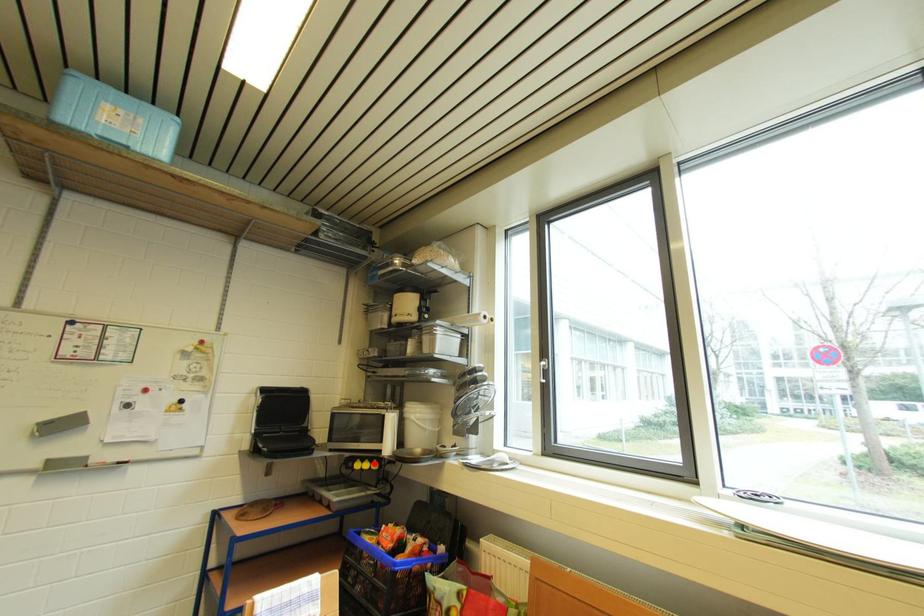
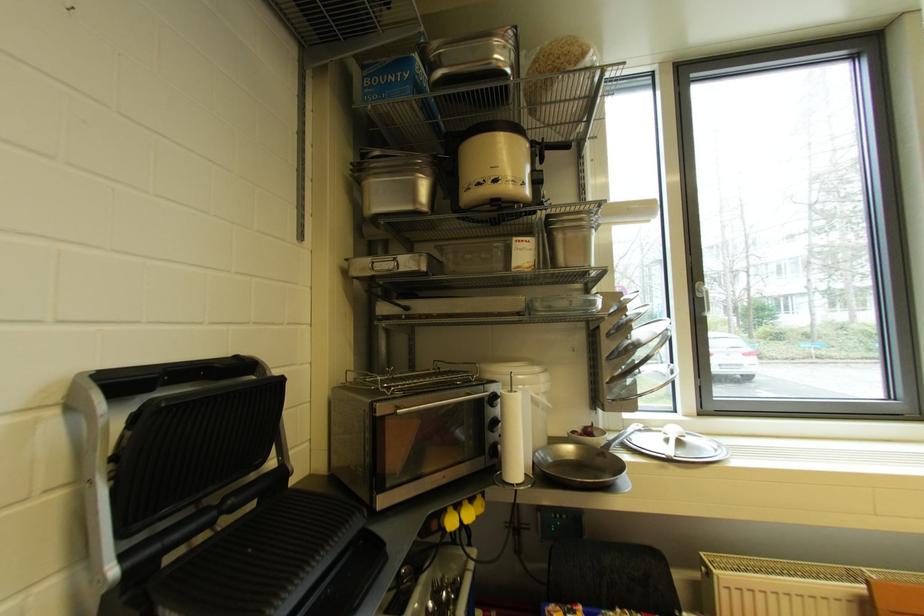
Find the pixel in the second image that matches the highlighted location in the first image.

(472, 505)